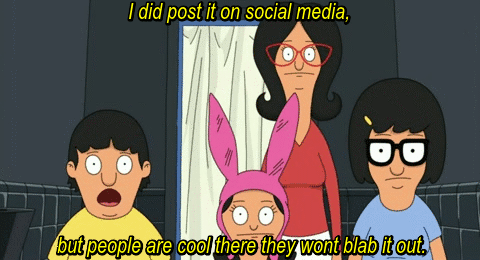
The width and height of the screenshot is (480, 260). I want to click on white curtains to center, left of woman with glasses, so click(x=206, y=67), click(x=208, y=165), click(x=243, y=111), click(x=260, y=136).